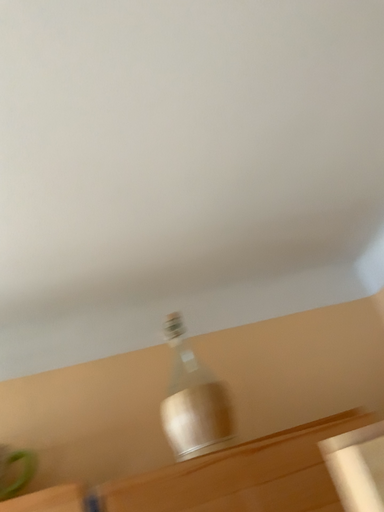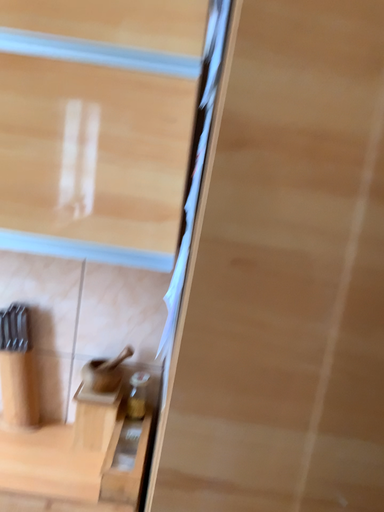
Question: Which way did the camera rotate in the video?

Choices:
 (A) rotated downward
 (B) rotated upward

Answer: (A)